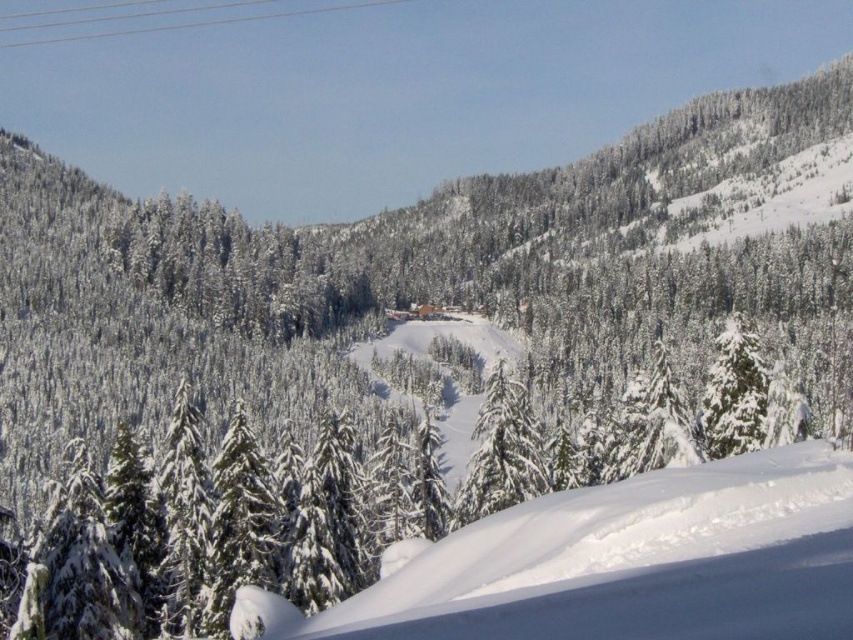
Does white snow ski slope at center appear under white snow-covered tree at center?

Incorrect, white snow ski slope at center is not positioned below white snow-covered tree at center.

Can you confirm if white snow ski slope at center is positioned to the right of white snow-covered tree at center?

In fact, white snow ski slope at center is to the left of white snow-covered tree at center.

Which is in front, point (689, 589) or point (525, 428)?

Point (689, 589)

The height and width of the screenshot is (640, 853). I want to click on white snow ski slope at center, so click(624, 563).